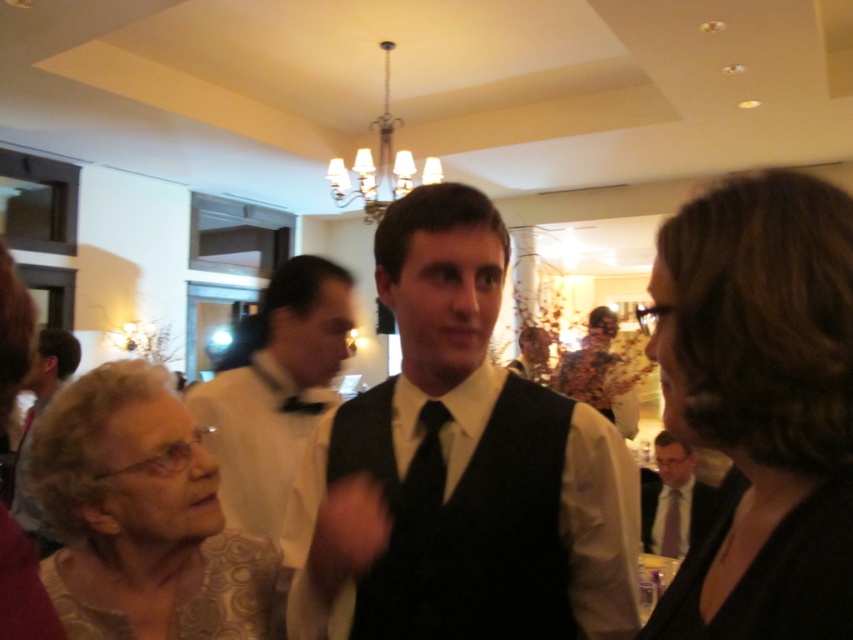
Is point (722, 493) less distant than point (99, 625)?

Yes.

Is black satin dress at lower right to the left of gold patterned dress at lower left from the viewer's perspective?

Incorrect, black satin dress at lower right is not on the left side of gold patterned dress at lower left.

Image resolution: width=853 pixels, height=640 pixels. In order to click on black satin dress at lower right in this screenshot , I will do `click(769, 573)`.

Based on the photo, does matte black tie at center have a lesser width compared to black silk tie at center?

Incorrect, matte black tie at center's width is not less than black silk tie at center's.

The height and width of the screenshot is (640, 853). What are the coordinates of `matte black tie at center` in the screenshot? It's located at (672, 500).

Is point (309, 369) closer to camera compared to point (608, 317)?

Yes, it is in front of point (608, 317).

Who is more forward, (x=270, y=513) or (x=614, y=381)?

Positioned in front is point (x=270, y=513).

At what (x,y) coordinates should I click in order to perform the action: click on white satin bow tie at center. Please return your answer as a coordinate pair (x, y). This screenshot has height=640, width=853. Looking at the image, I should click on (274, 387).